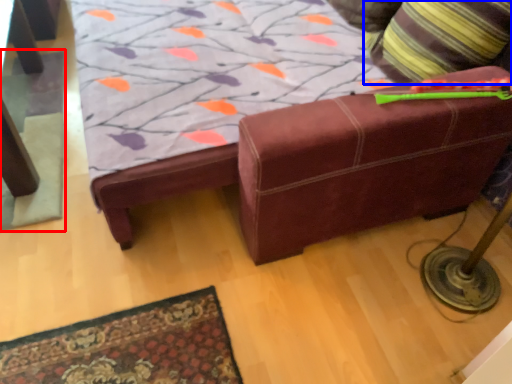
Question: Which of the following is the farthest to the observer, mat (highlighted by a red box) or throw pillow (highlighted by a blue box)?

Choices:
 (A) mat
 (B) throw pillow

Answer: (A)